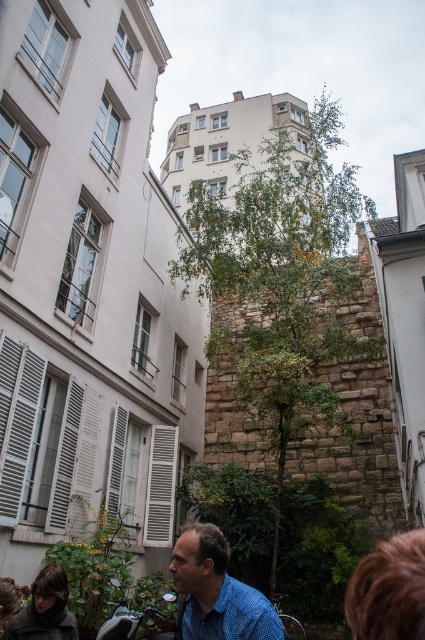
Question: Based on their relative distances, which object is farther from the green leafy tree at center?

Choices:
 (A) blue checkered shirt at lower center
 (B) shiny chrome motorcycle at lower left

Answer: (A)

Question: Does green leafy tree at center appear under shiny chrome motorcycle at lower left?

Choices:
 (A) yes
 (B) no

Answer: (B)

Question: Can you confirm if blue checkered shirt at lower center is positioned to the left of shiny chrome motorcycle at lower left?

Choices:
 (A) yes
 (B) no

Answer: (B)

Question: Which of the following is the closest to the observer?

Choices:
 (A) (181, 544)
 (B) (271, 404)

Answer: (A)

Question: Among these points, which one is nearest to the camera?

Choices:
 (A) (112, 586)
 (B) (187, 554)
 (C) (258, 404)

Answer: (B)

Question: Can you confirm if green leafy tree at center is smaller than shiny chrome motorcycle at lower left?

Choices:
 (A) yes
 (B) no

Answer: (B)